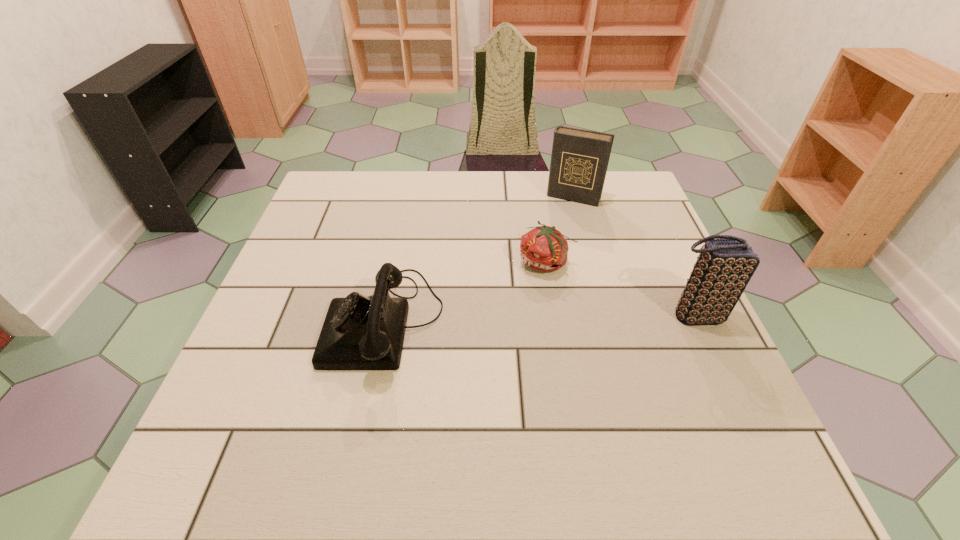
At what (x,y) coordinates should I click in order to perform the action: click on object that is at the far right corner. Please return your answer as a coordinate pair (x, y). The image size is (960, 540). Looking at the image, I should click on (579, 160).

At what (x,y) coordinates should I click in order to perform the action: click on free spot at the far edge of the desktop. Please return your answer as a coordinate pair (x, y). The height and width of the screenshot is (540, 960). Looking at the image, I should click on (516, 181).

You are a GUI agent. You are given a task and a screenshot of the screen. Output one action in this format:
    pyautogui.click(x=<x>, y=<y>)
    Task: Click on the vacant position at the near edge of the desktop
    This screenshot has width=960, height=540.
    Given the screenshot: What is the action you would take?
    pyautogui.click(x=384, y=399)

Where is `free space at the left edge of the desktop`? The image size is (960, 540). free space at the left edge of the desktop is located at coordinates (316, 222).

Identify the location of free space at the right edge of the desktop. The height and width of the screenshot is (540, 960). (648, 251).

Identify the location of vacant area at the far left corner. The image size is (960, 540). (379, 173).

I want to click on vacant space at the far right corner of the desktop, so click(626, 183).

Where is `vacant space at the near right corner of the desktop`? vacant space at the near right corner of the desktop is located at coordinates (688, 416).

The image size is (960, 540). Find the location of `blank region between the tomato and the leftmost object`. blank region between the tomato and the leftmost object is located at coordinates (466, 292).

This screenshot has width=960, height=540. Identify the location of free space between the farthest object and the third tallest object. (479, 259).